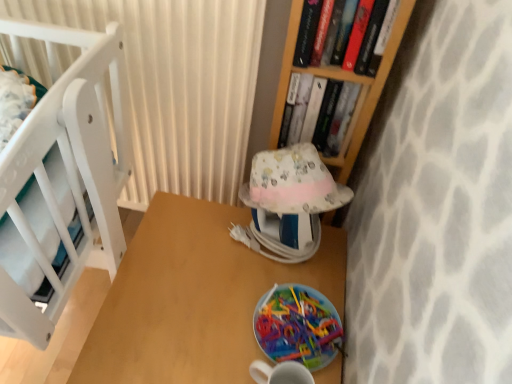
Question: From the image's perspective, is hardcover book at upper center, arranged as the 2th book when viewed from the front, positioned above or below hardcover book at upper right, the second book in the back-to-front sequence?

Choices:
 (A) below
 (B) above

Answer: (A)

Question: From a real-world perspective, is hardcover book at upper center, arranged as the 2th book when viewed from the front, positioned above or below hardcover book at upper right, the second book in the back-to-front sequence?

Choices:
 (A) below
 (B) above

Answer: (A)

Question: Which object is positioned closest to the white textured curtain at upper left?

Choices:
 (A) wooden table at center
 (B) hardcover book at upper right, which appears as the 1th book when viewed from the front
 (C) hardcover book at upper center, arranged as the 2th book when viewed from the front
 (D) patterned fabric lampshade at center
 (E) translucent plastic plate at lower center

Answer: (D)

Question: Which is nearer to the hardcover book at upper center, the first book positioned from the back?

Choices:
 (A) hardcover book at upper right, the second book in the back-to-front sequence
 (B) white textured curtain at upper left
 (C) translucent plastic plate at lower center
 (D) wooden table at center
 (E) patterned fabric lampshade at center

Answer: (A)